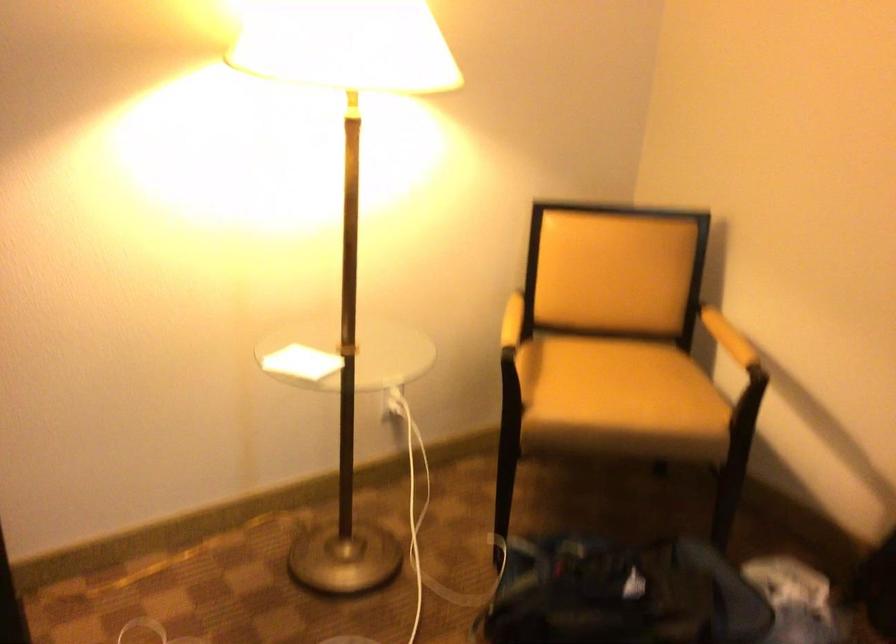
I want to click on small white paper, so click(300, 363).